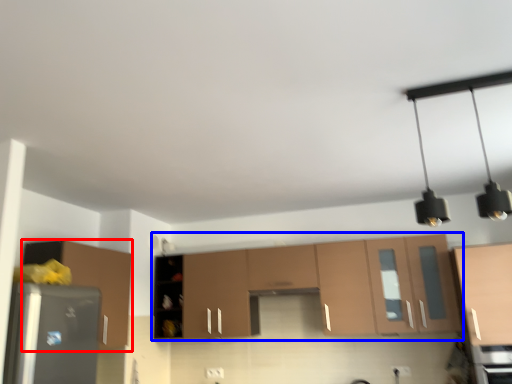
Question: Which of the following is the farthest to the observer, cabinetry (highlighted by a red box) or cabinetry (highlighted by a blue box)?

Choices:
 (A) cabinetry
 (B) cabinetry

Answer: (B)